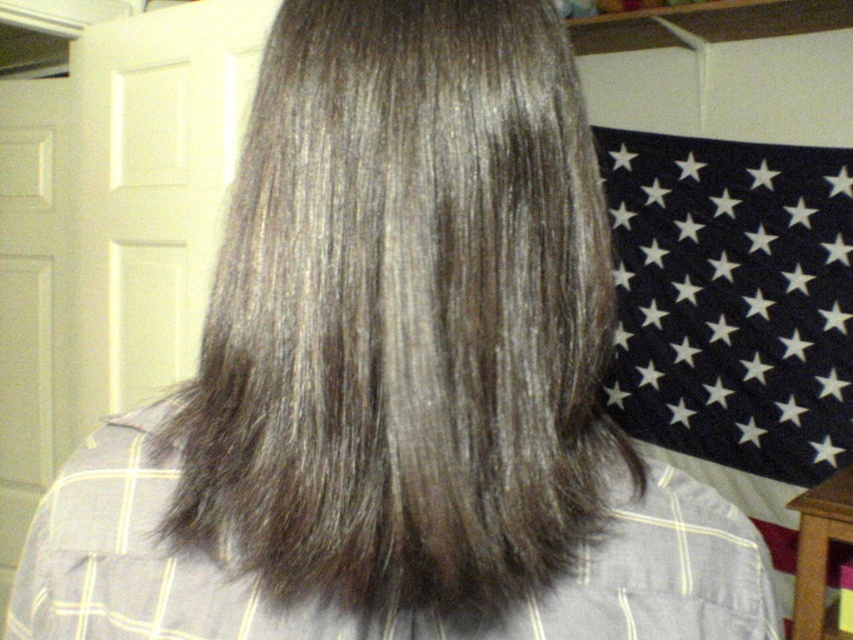
You are an interior designer assessing the layout of a room. You notice the black fabric flag at upper right and the gray matte hair at center. Which object occupies more horizontal space in the image?

The black fabric flag at upper right occupies more horizontal space in the image because its width is larger than that of the gray matte hair at center.